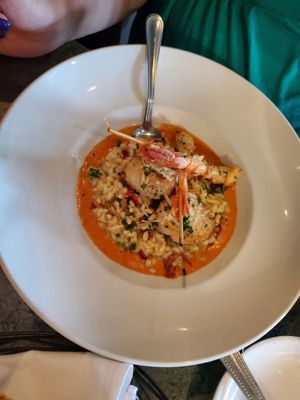
Locate an element on the screen. The height and width of the screenshot is (400, 300). napkins is located at coordinates [79, 377].